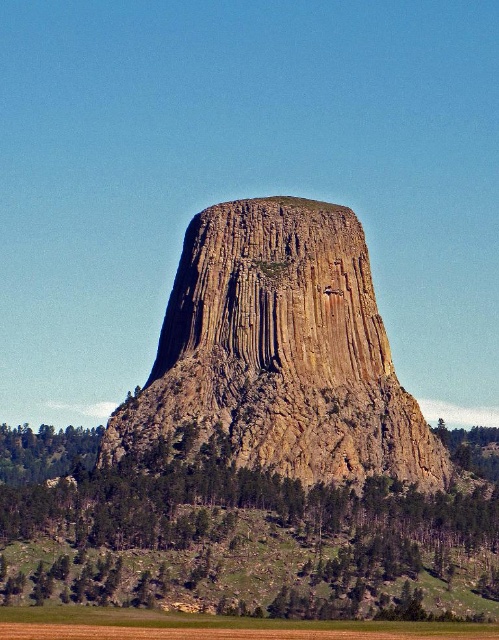
In the scene shown: How distant is green leafy trees at lower left from green leafy tree at lower left?

They are 11.77 meters apart.

Does green leafy trees at lower left have a larger size compared to green leafy tree at lower left?

Yes.

Which is in front, point (180, 580) or point (6, 474)?

Point (180, 580) is more forward.

At what (x,y) coordinates should I click in order to perform the action: click on green leafy trees at lower left. Please return your answer as a coordinate pair (x, y). The width and height of the screenshot is (499, 640). Looking at the image, I should click on (252, 541).

Between yellowish-brown rock at center and green leafy tree at lower left, which one is positioned higher?

yellowish-brown rock at center

Looking at this image, does yellowish-brown rock at center have a lesser width compared to green leafy tree at lower left?

In fact, yellowish-brown rock at center might be wider than green leafy tree at lower left.

The height and width of the screenshot is (640, 499). What do you see at coordinates (279, 353) in the screenshot?
I see `yellowish-brown rock at center` at bounding box center [279, 353].

Locate an element on the screen. The height and width of the screenshot is (640, 499). yellowish-brown rock at center is located at coordinates (279, 353).

Who is lower down, green leafy trees at lower left or green leafy tree at lower right?

green leafy trees at lower left is below.

Does green leafy trees at lower left have a lesser height compared to green leafy tree at lower right?

Incorrect, green leafy trees at lower left's height does not fall short of green leafy tree at lower right's.

Is point (399, 506) more distant than point (478, 461)?

No.

At what (x,y) coordinates should I click in order to perform the action: click on green leafy trees at lower left. Please return your answer as a coordinate pair (x, y). Image resolution: width=499 pixels, height=640 pixels. Looking at the image, I should click on (252, 541).